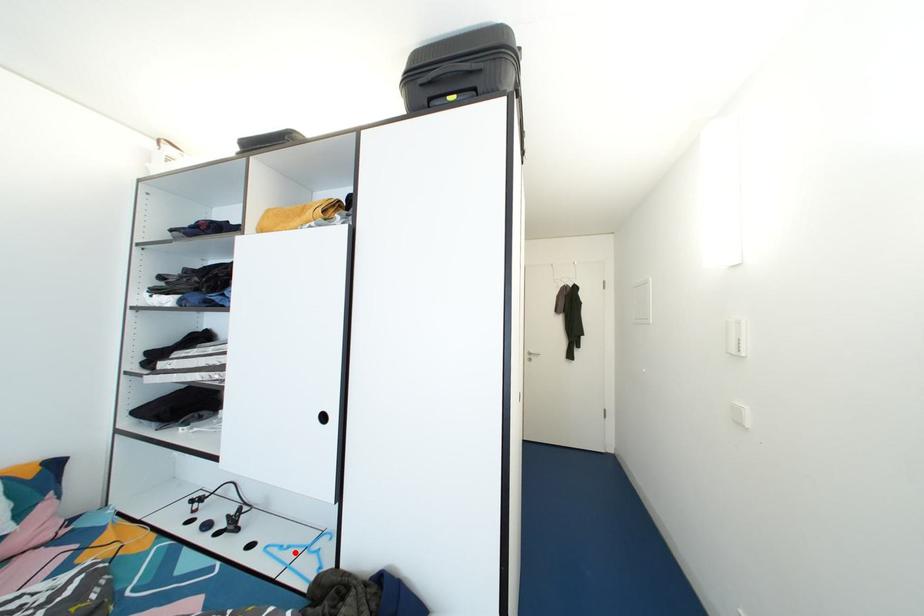
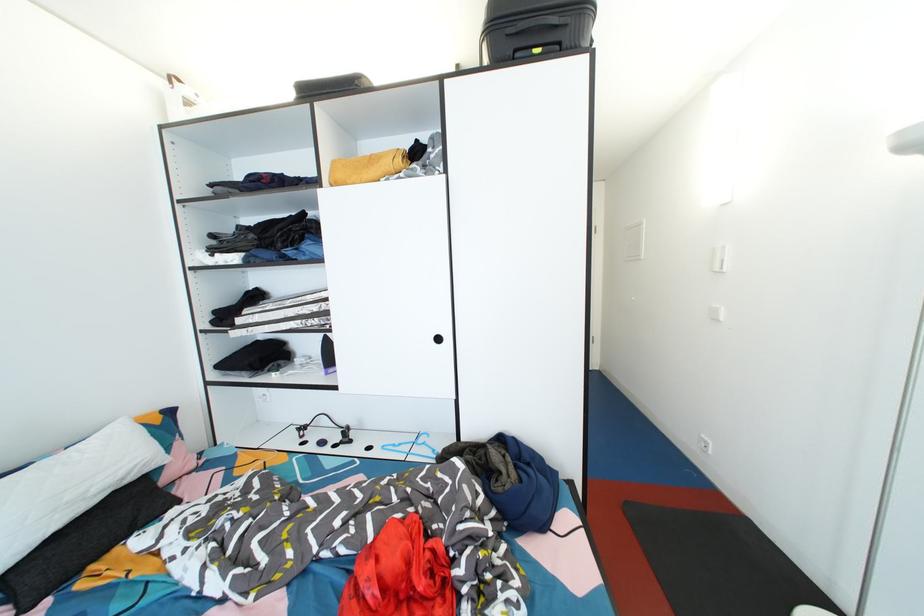
Locate, in the second image, the point that corresponds to the highlighted location in the first image.

(407, 450)